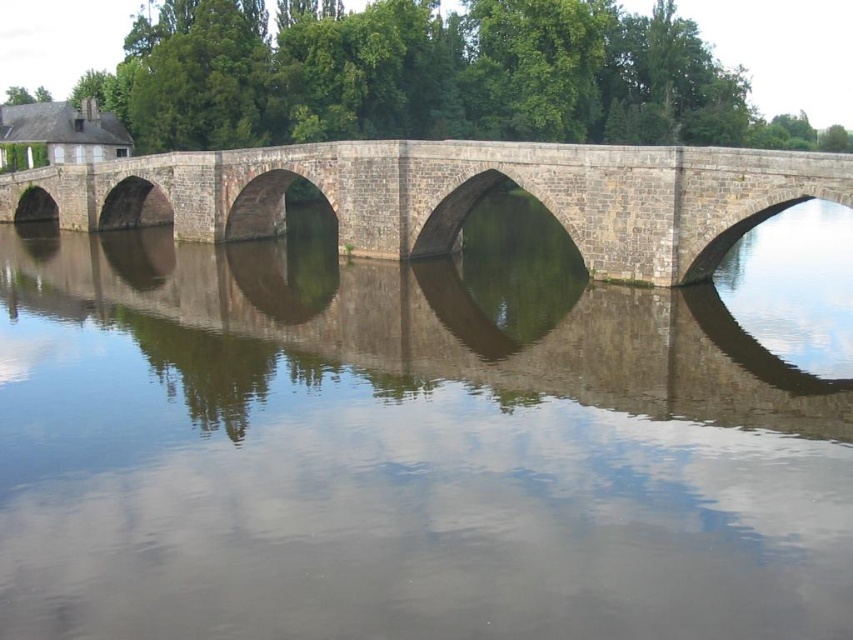
Question: Does smooth gray water at center appear over stone bridge at center?

Choices:
 (A) no
 (B) yes

Answer: (A)

Question: Among these objects, which one is farthest from the camera?

Choices:
 (A) smooth gray water at center
 (B) stone bridge at center

Answer: (B)

Question: Does smooth gray water at center appear under stone bridge at center?

Choices:
 (A) yes
 (B) no

Answer: (A)

Question: Is smooth gray water at center positioned before stone bridge at center?

Choices:
 (A) yes
 (B) no

Answer: (A)

Question: Among these points, which one is nearest to the camera?

Choices:
 (A) (404, 454)
 (B) (434, 186)

Answer: (A)